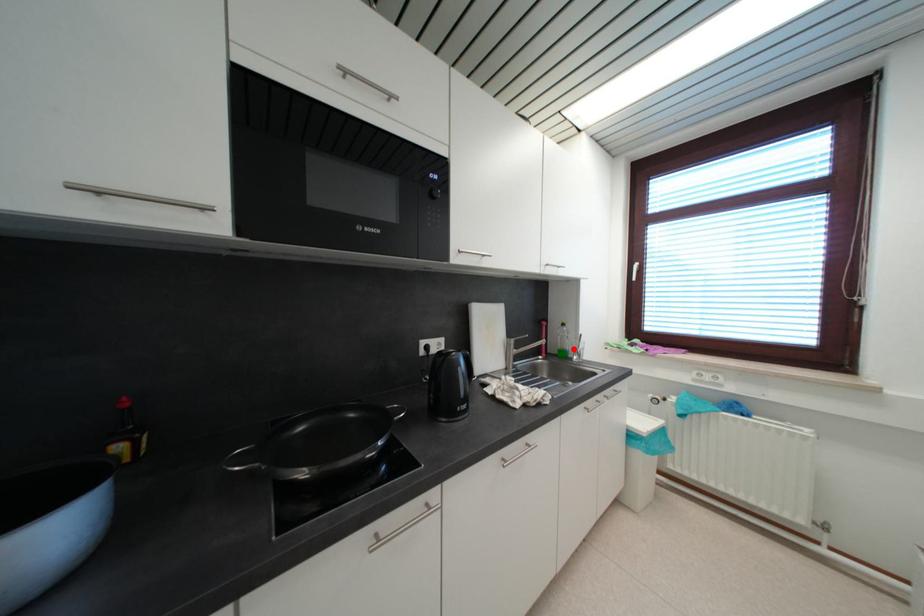
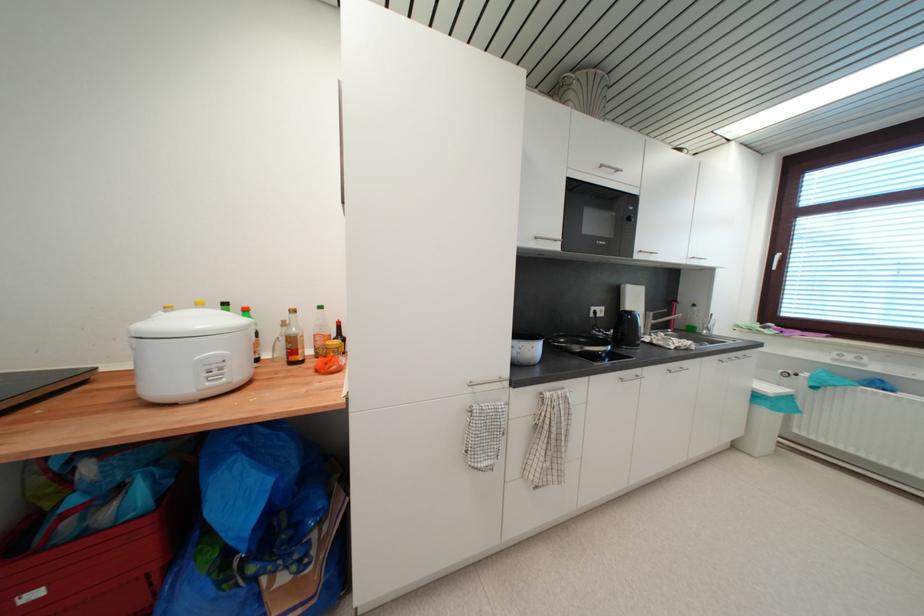
Question: I am providing you with two images of the same scene from different viewpoints. Given a red point in image1, look at the same physical point in image2. Is it:

Choices:
 (A) Closer to the viewpoint
 (B) Farther from the viewpoint

Answer: (A)